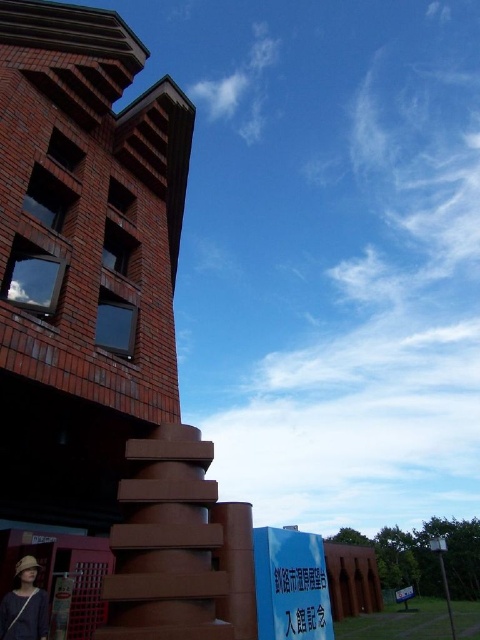
You are standing in front of the building and want to take a photo that includes both the entrance with the red door and the brown cylindrical elements. Based on their positions, which of the two points, point 1 at coordinates (2, 600) or point 2 at (408, 595), is closer to you and thus likely in focus if you focus on the entrance?

Point 1 at coordinates (2, 600) is closer to the viewer than point 2 at (408, 595). Therefore, if focusing on the entrance, point 1 would be in focus while point 2 might be slightly out of focus.

You are a photographer trying to capture the entrance of the building. You notice the matte brown hat at lower left and the white plastic sign at lower right in your shot. Which object should you adjust your camera angle to avoid covering the entrance details? Explain your reasoning.

The matte brown hat at lower left has a smaller size compared to the white plastic sign at lower right. Since the sign is larger, it is more likely to obstruct the entrance details, so you should adjust your camera angle to avoid covering the entrance details by moving around the white plastic sign at lower right.